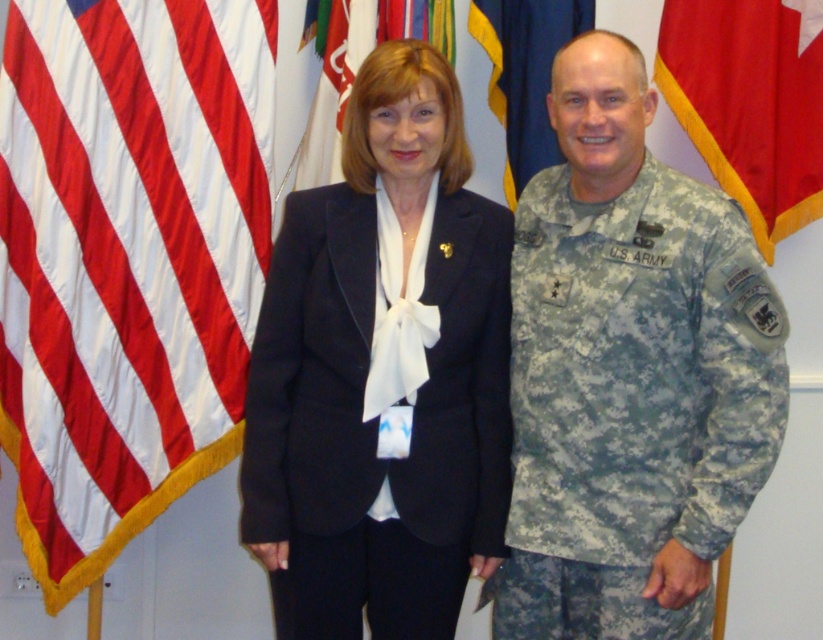
From the picture: You are organizing a military ceremony and need to ensure proper spacing between the silky satin flag at left and the camouflage fabric us army uniform at right. Given their sizes, which one requires more space to display appropriately?

The camouflage fabric us army uniform at right requires more space to display appropriately because it occupies more space than the silky satin flag at left according to the description.

You are organizing a military ceremony and need to ensure proper placement of the matte black suit at center and the silky satin flag at left. According to the image, which object should be placed first if you want to follow the size hierarchy from largest to smallest?

The matte black suit at center should be placed first because it is larger than the silky satin flag at left.